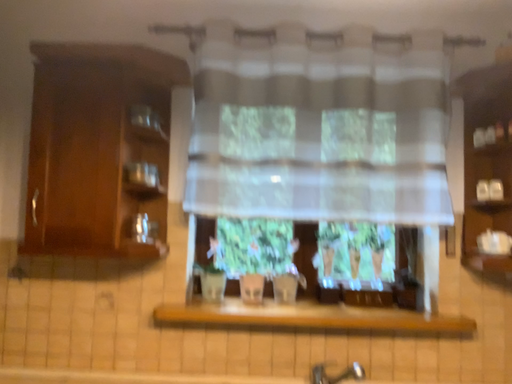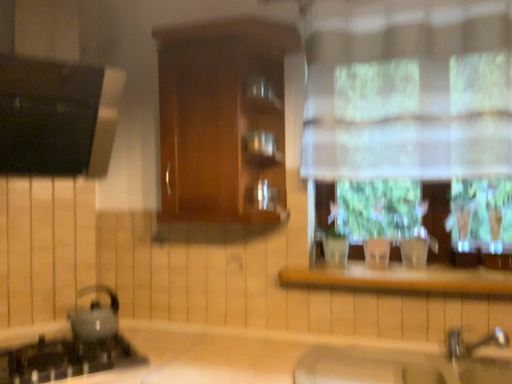
Question: How did the camera likely rotate when shooting the video?

Choices:
 (A) rotated right
 (B) rotated left

Answer: (B)